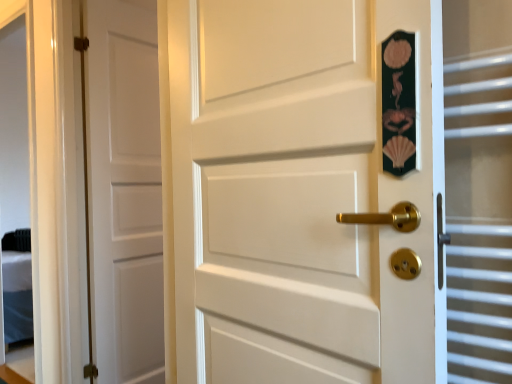
Question: Considering their positions, is clear glass door at right located in front of or behind white matte door at left, which is the 2th door from right to left?

Choices:
 (A) front
 (B) behind

Answer: (A)

Question: From the image's perspective, is clear glass door at right located above or below white matte door at left, which ranks as the second door in front-to-back order?

Choices:
 (A) above
 (B) below

Answer: (B)

Question: Which of these objects is positioned closest to the clear glass door at right?

Choices:
 (A) white matte door at left, which is counted as the 1th door, starting from the left
 (B) white matte door at center, the 2th door positioned from the left

Answer: (B)

Question: Which of these objects is positioned farthest from the white matte door at left, which ranks as the second door in front-to-back order?

Choices:
 (A) white matte door at center, which ranks as the first door in front-to-back order
 (B) clear glass door at right

Answer: (B)